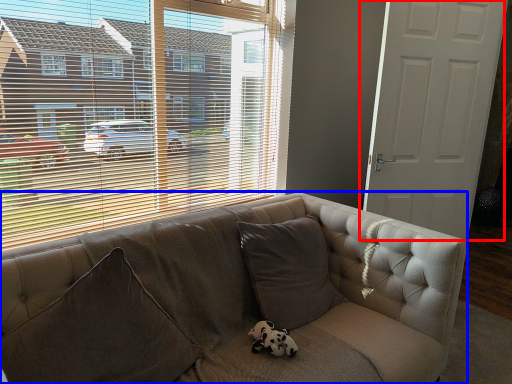
Question: Which object is further to the camera taking this photo, door (highlighted by a red box) or studio couch (highlighted by a blue box)?

Choices:
 (A) door
 (B) studio couch

Answer: (A)